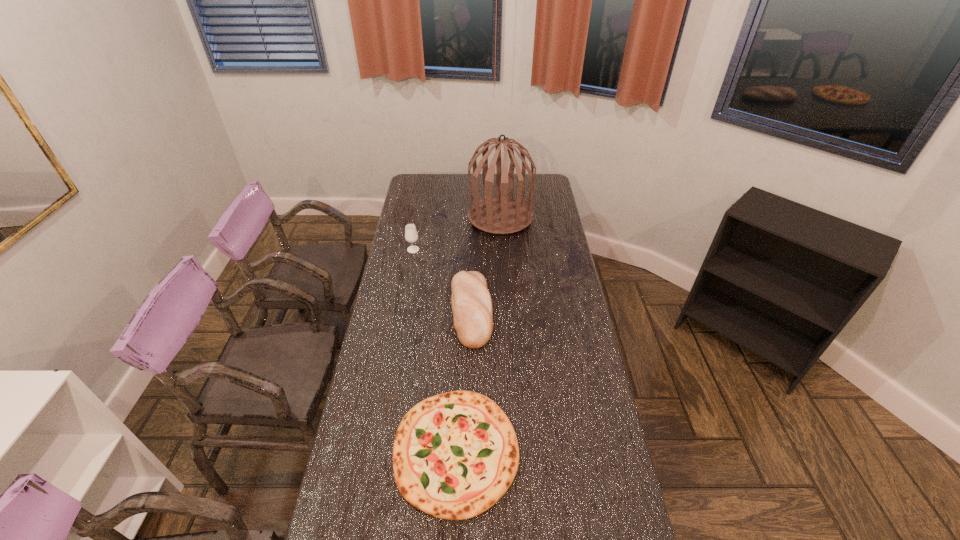
Locate an element on the screen. This screenshot has width=960, height=540. free space located on the front of the second shortest object is located at coordinates (469, 388).

This screenshot has width=960, height=540. In order to click on vacant space situated on the back of the shortest object in this screenshot , I will do `click(462, 314)`.

Locate an element on the screen. The height and width of the screenshot is (540, 960). glass that is at the left edge is located at coordinates (411, 235).

The image size is (960, 540). I want to click on pizza at the left edge, so click(455, 454).

Where is `object that is at the right edge`? The height and width of the screenshot is (540, 960). object that is at the right edge is located at coordinates (502, 215).

In the image, there is a desktop. Identify the location of free space at the far edge. Image resolution: width=960 pixels, height=540 pixels. (457, 184).

This screenshot has width=960, height=540. Identify the location of vacant space at the left edge. (420, 217).

At what (x,y) coordinates should I click in order to perform the action: click on free space at the right edge of the desktop. Please return your answer as a coordinate pair (x, y). Image resolution: width=960 pixels, height=540 pixels. Looking at the image, I should click on (549, 259).

This screenshot has height=540, width=960. Identify the location of unoccupied area between the leftmost object and the nearest object. (435, 350).

Image resolution: width=960 pixels, height=540 pixels. I want to click on free space between the third nearest object and the second shortest object, so click(443, 280).